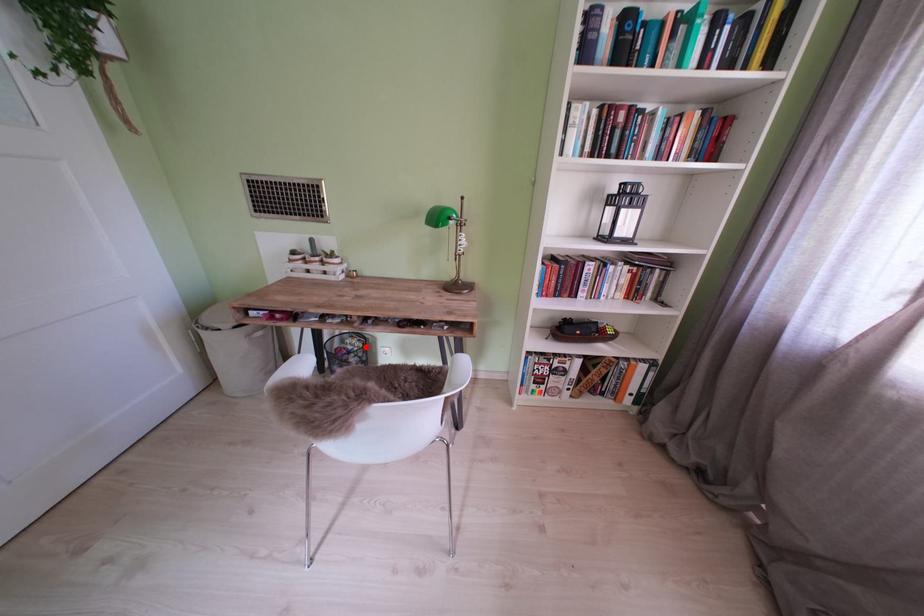
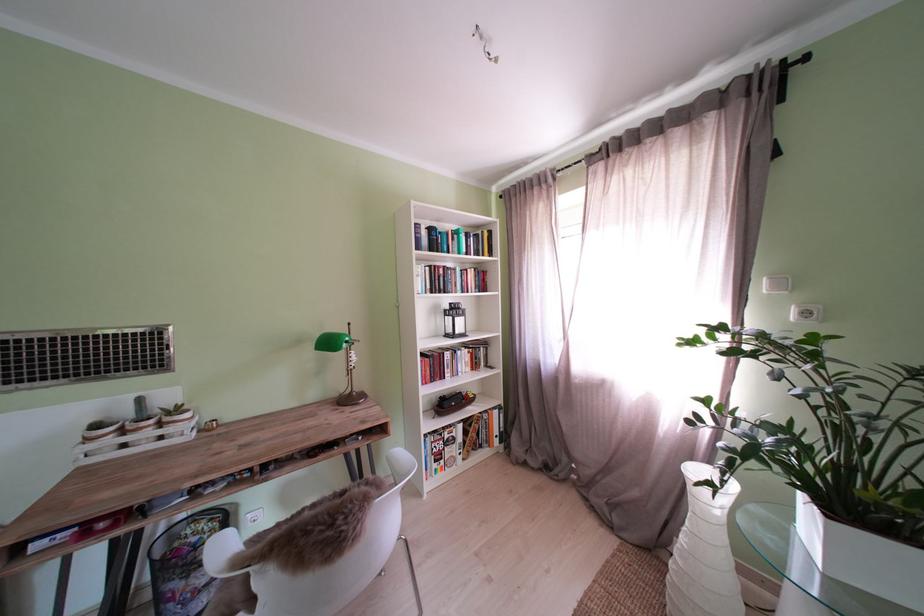
Find the pixel in the second image that matches the highlighted location in the first image.

(213, 530)